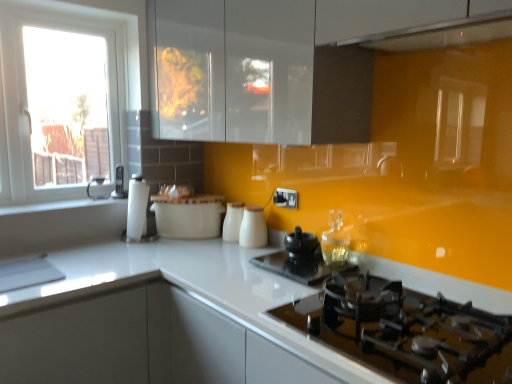
At what (x,y) coordinates should I click in order to perform the action: click on free location above black glass kettle at center, the first appliance when ordered from bottom to top (from a real-world perspective). Please return your answer as a coordinate pair (x, y). This screenshot has height=384, width=512. Looking at the image, I should click on (286, 256).